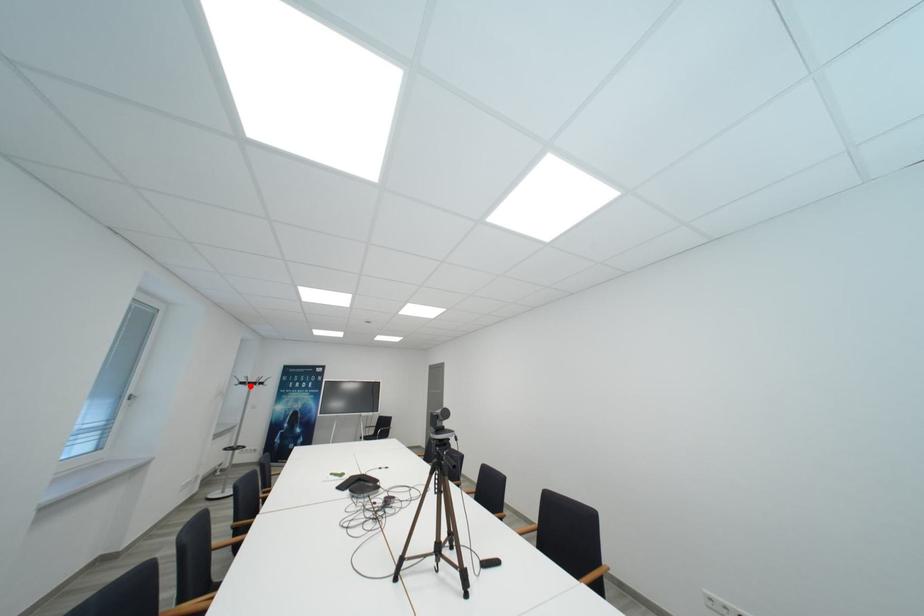
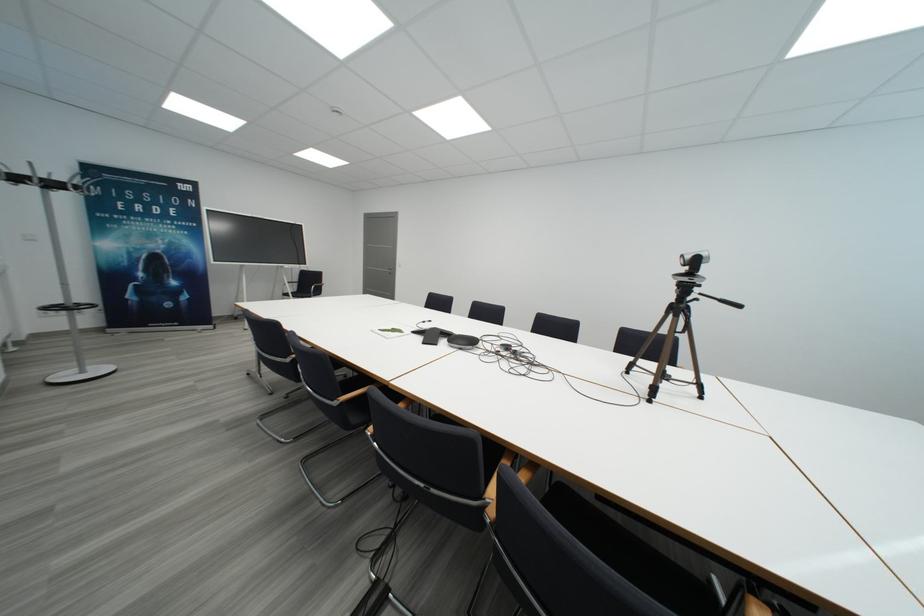
Find the pixel in the second image that matches the highlighted location in the first image.

(21, 180)